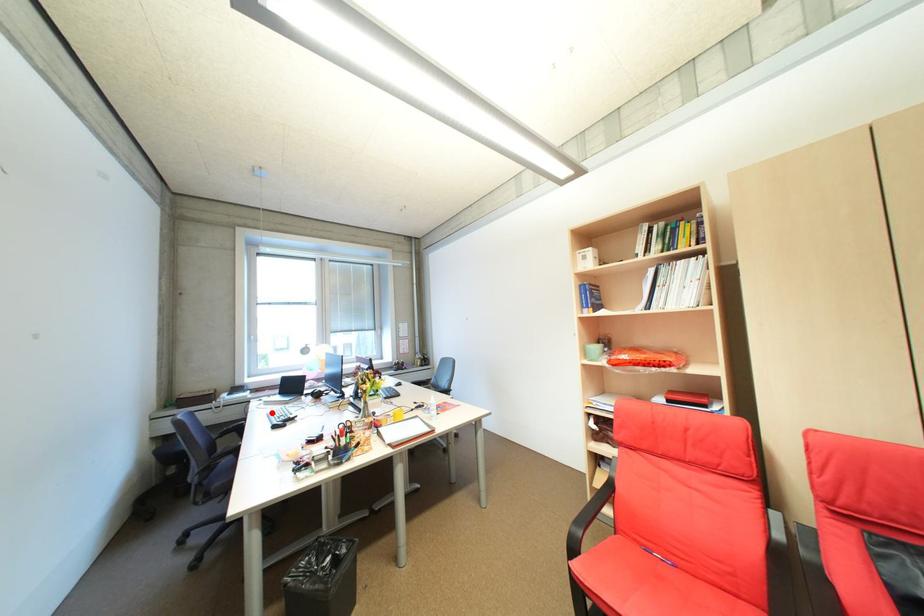
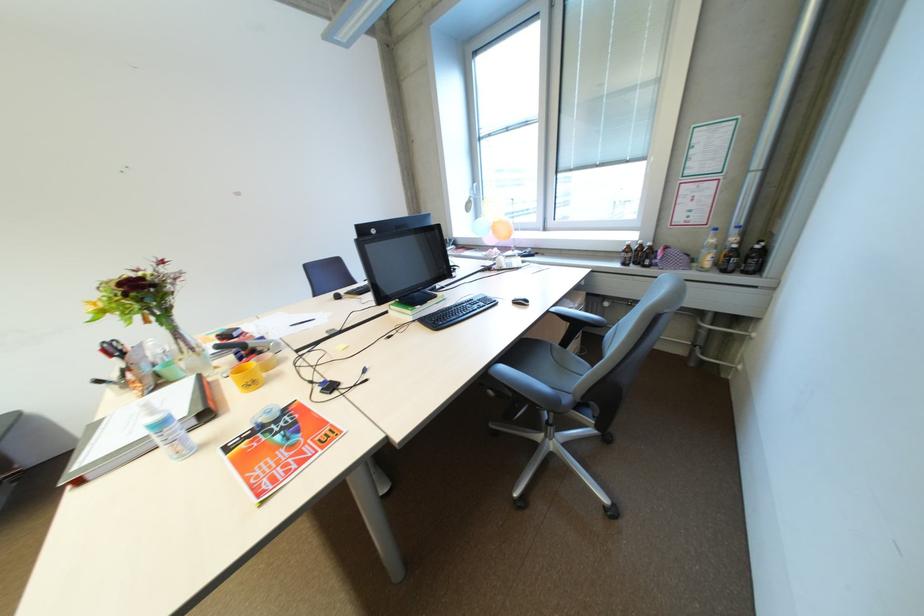
Question: I am providing you with two images of the same scene from different viewpoints. A red point is marked on the first image. Can you still see the location of the red point in image 2?

Choices:
 (A) Yes
 (B) No

Answer: (B)